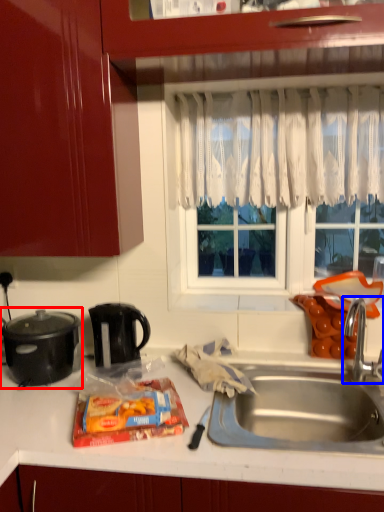
Question: Which object appears closest to the camera in this image, kitchen appliance (highlighted by a red box) or tap (highlighted by a blue box)?

Choices:
 (A) kitchen appliance
 (B) tap

Answer: (B)